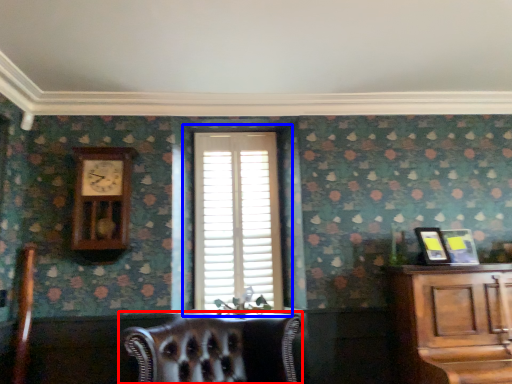
Question: Which object is further to the camera taking this photo, chair (highlighted by a red box) or window (highlighted by a blue box)?

Choices:
 (A) chair
 (B) window

Answer: (B)